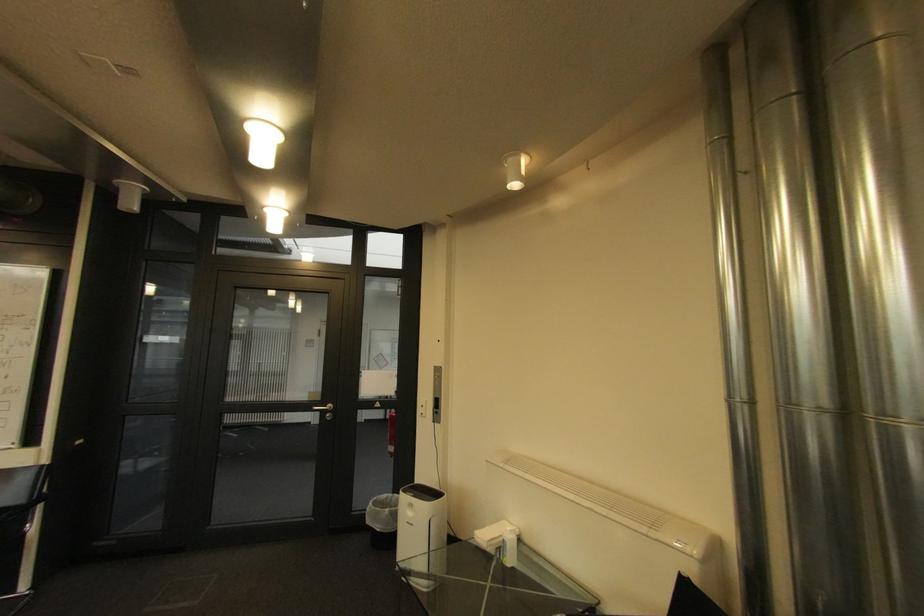
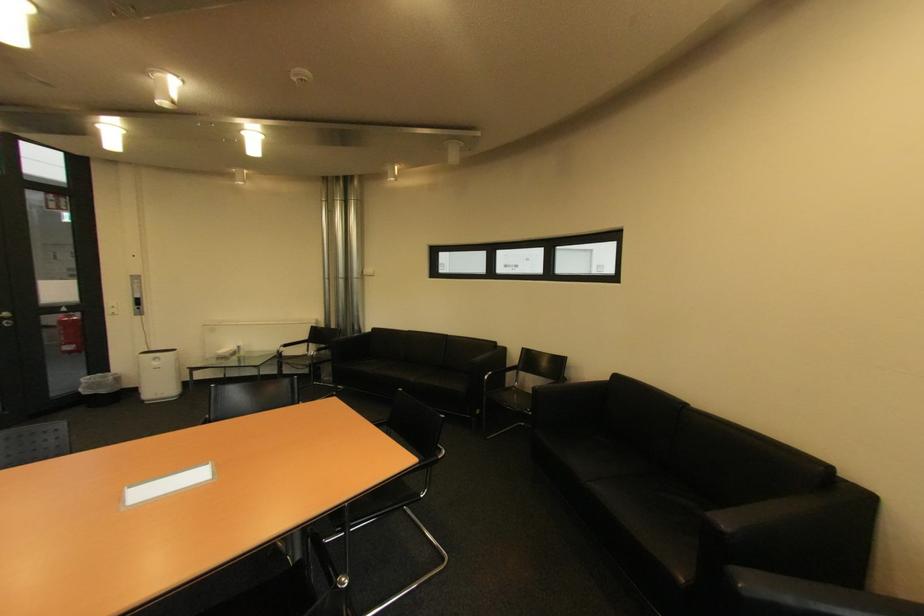
In the second image, find the point that corresponds to point 444,377 in the first image.

(140, 283)